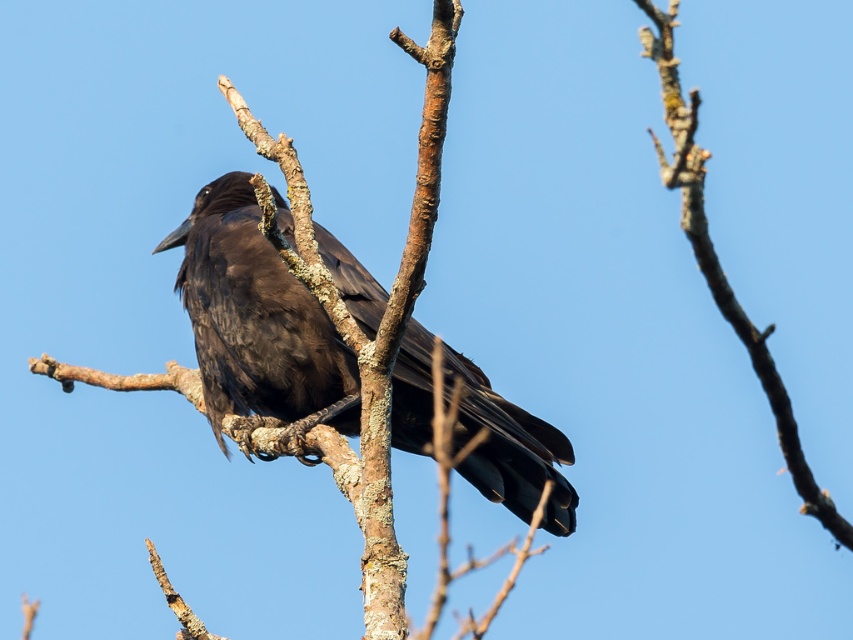
Does point (207, 209) come closer to viewer compared to point (668, 28)?

No, (207, 209) is behind (668, 28).

Is shiny black raven at center bigger than smooth bark branch at upper center?

Yes, shiny black raven at center is bigger than smooth bark branch at upper center.

Where is `shiny black raven at center`? shiny black raven at center is located at coordinates (257, 321).

I want to click on shiny black raven at center, so click(257, 321).